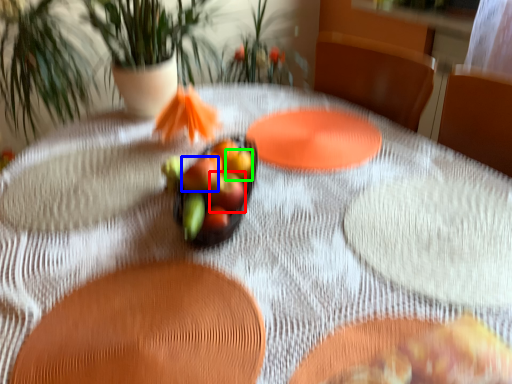
Question: Which is nearer to the apple (highlighted by a red box)? flower (highlighted by a blue box) or apple (highlighted by a green box).

Choices:
 (A) flower
 (B) apple

Answer: (A)